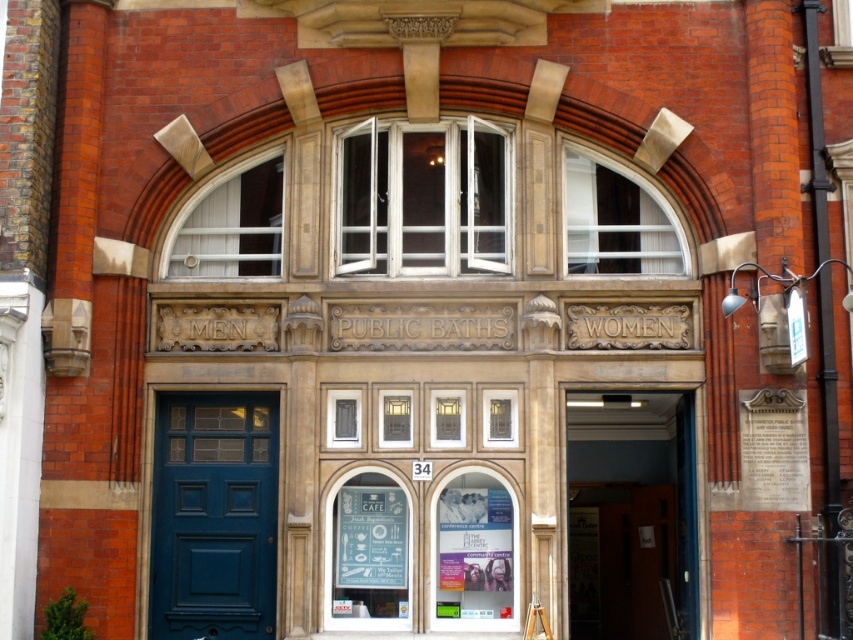
In the scene shown: Is wooden door at center bigger than blue painted wood door at center?

Indeed, wooden door at center has a larger size compared to blue painted wood door at center.

Can you confirm if wooden door at center is positioned below blue painted wood door at center?

Indeed, wooden door at center is positioned under blue painted wood door at center.

Is point (642, 429) in front of point (262, 634)?

No, it is behind (262, 634).

This screenshot has height=640, width=853. Identify the location of wooden door at center. (x=631, y=515).